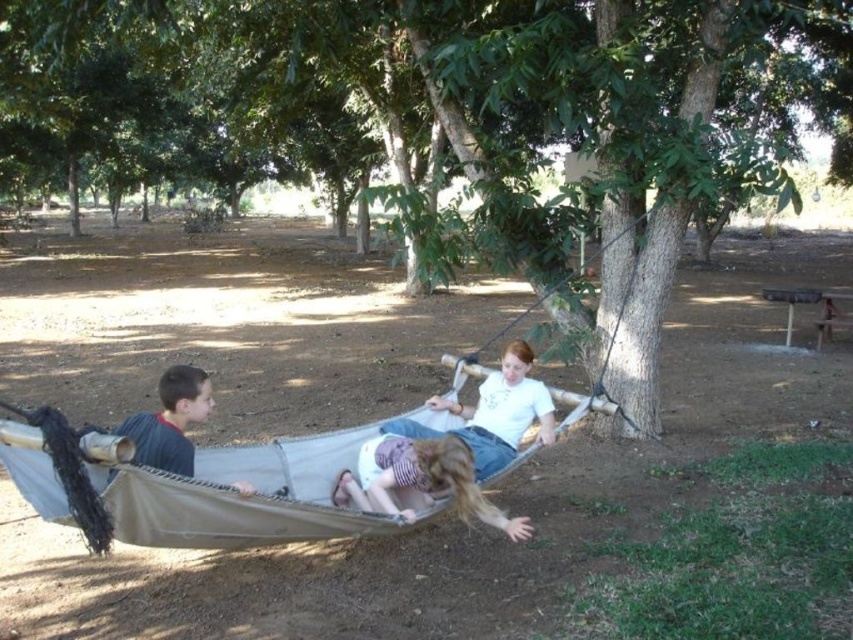
Based on the photo, you are standing in the outdoor area and want to find the gray fabric hammock at left. Which direction should you look relative to the light purple fabric hammock at center?

The light purple fabric hammock at center is to the right of the gray fabric hammock at left, so to find the gray fabric hammock at left, you should look to the left side of the light purple fabric hammock at center.

What object is located at the coordinates point (421,481) in the image?

The point (421,481) indicates the light purple fabric hammock at center.

Looking at this image, you are planning to hang a new hammock in your backyard. You have a gray fabric hammock at left and a green leafy tree at center. Which object is bigger and would be more suitable as an anchor point for the hammock?

The green leafy tree at center is larger in size than the gray fabric hammock at left, making it a more suitable anchor point for the hammock.